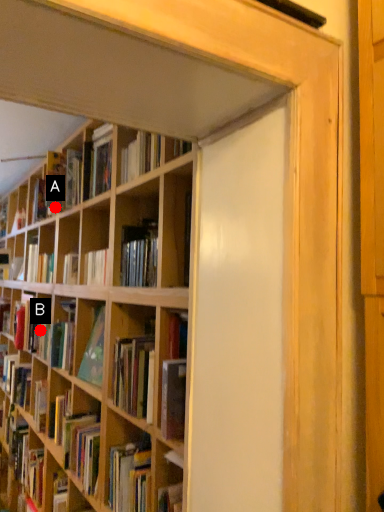
Question: Two points are circled on the image, labeled by A and B beside each circle. Which point is further to the camera?

Choices:
 (A) A is further
 (B) B is further

Answer: (B)